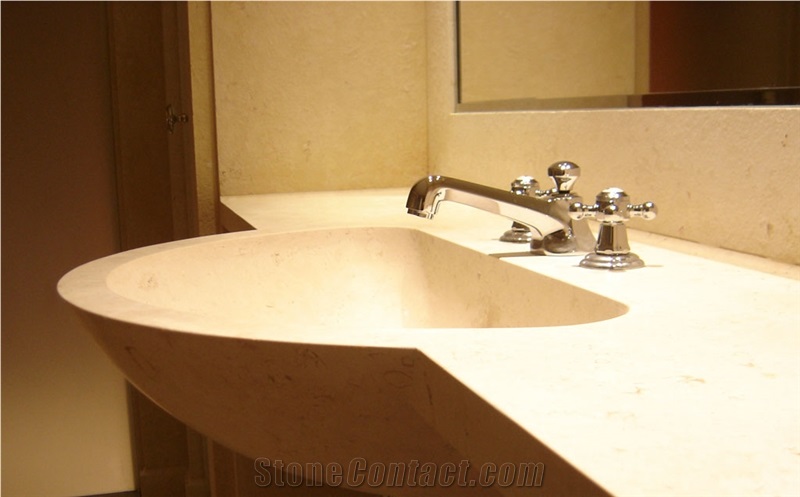
What are the coordinates of `underside of basin` in the screenshot? It's located at (210, 409).